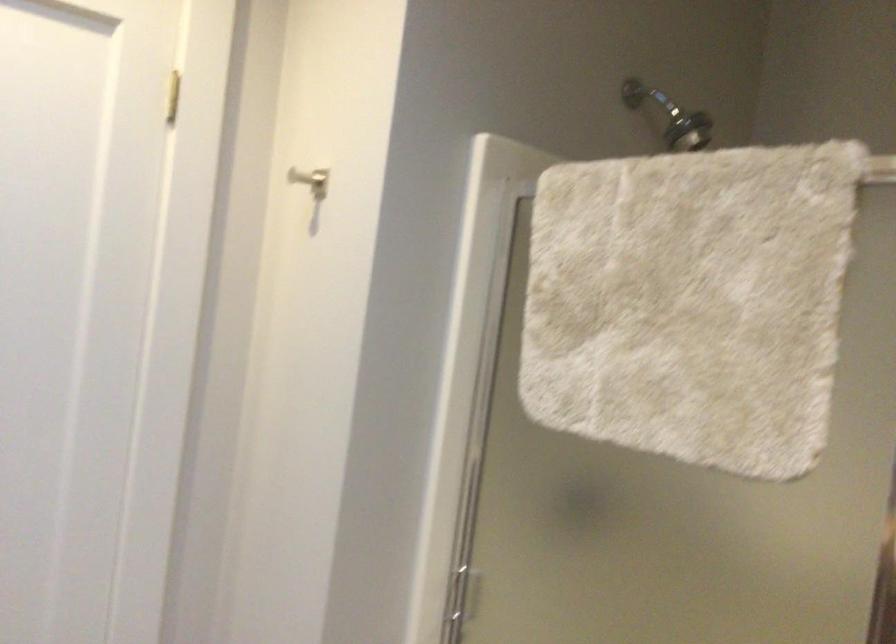
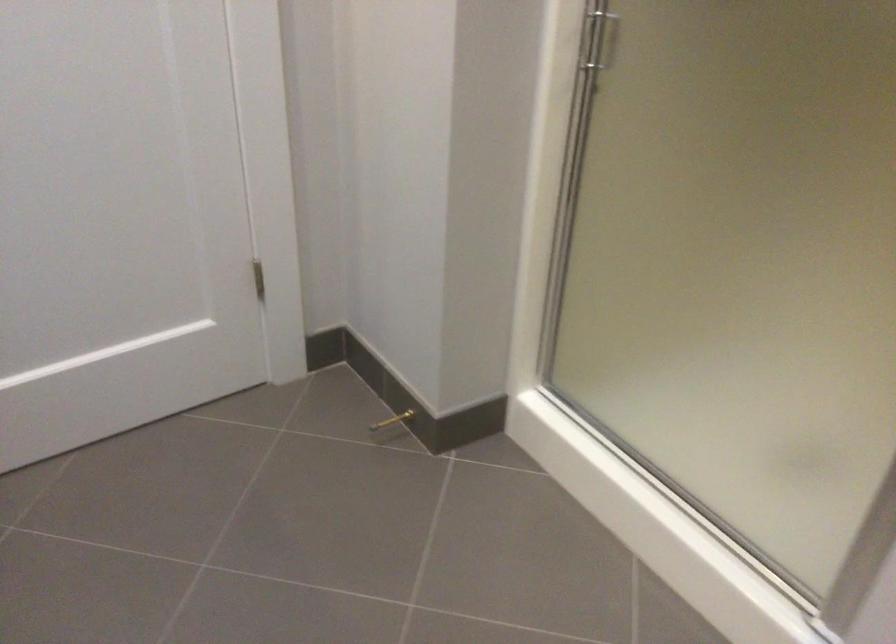
Question: What movement of the cameraman would produce the second image?

Choices:
 (A) Left
 (B) Right
 (C) Forward
 (D) Backward

Answer: (A)